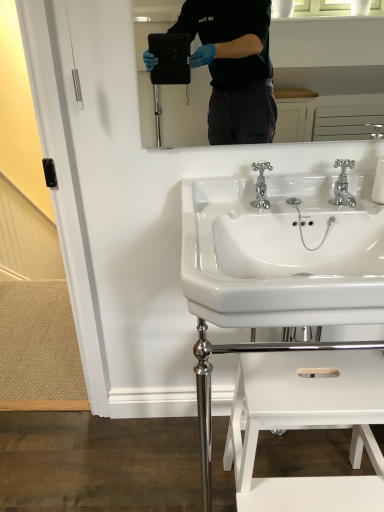
This screenshot has height=512, width=384. I want to click on white glossy sink at center, arranged as the 1th sink when viewed from the top, so [282, 253].

What do you see at coordinates (307, 425) in the screenshot? This screenshot has width=384, height=512. I see `white glossy step stool at lower center` at bounding box center [307, 425].

I want to click on white glossy sink at center, acting as the 2th sink starting from the bottom, so click(282, 253).

Does point (349, 160) come farther from viewer compared to point (299, 238)?

Yes, it is.

From a real-world perspective, count 2nd sinks downward from the chrome metallic faucet at upper right, which appears as the second tap when viewed from the left, and point to it. Please provide its 2D coordinates.

[(277, 268)]

Which object is positioned more to the right, chrome metallic faucet at upper right, positioned as the first tap in right-to-left order, or white glossy sink at center, the first sink when ordered from bottom to top?

From the viewer's perspective, chrome metallic faucet at upper right, positioned as the first tap in right-to-left order, appears more on the right side.

Does white glossy step stool at lower center have a greater width compared to white glossy sink at center, arranged as the 1th sink when viewed from the top?

In fact, white glossy step stool at lower center might be narrower than white glossy sink at center, arranged as the 1th sink when viewed from the top.

From the image's perspective, is white glossy step stool at lower center below white glossy sink at center, acting as the 2th sink starting from the bottom?

Yes, from the image's perspective, white glossy step stool at lower center is below white glossy sink at center, acting as the 2th sink starting from the bottom.

Between white glossy step stool at lower center and white glossy sink at center, acting as the 2th sink starting from the bottom, which one appears on the left side from the viewer's perspective?

white glossy sink at center, acting as the 2th sink starting from the bottom.

Considering the positions of point (345, 170) and point (254, 201), is point (345, 170) closer or farther from the camera than point (254, 201)?

Point (345, 170).

Does chrome metallic faucet at upper right, positioned as the first tap in right-to-left order, have a greater height compared to chrome metallic faucet at center, which is the 1th tap from left to right?

Indeed, chrome metallic faucet at upper right, positioned as the first tap in right-to-left order, has a greater height compared to chrome metallic faucet at center, which is the 1th tap from left to right.

Locate an element on the screen. The height and width of the screenshot is (512, 384). tap behind the chrome metallic faucet at center, which is the 1th tap from left to right is located at coordinates (343, 185).

Based on their positions, is chrome metallic faucet at upper right, positioned as the first tap in right-to-left order, located to the left or right of chrome metallic faucet at center, which is the 1th tap from left to right?

chrome metallic faucet at upper right, positioned as the first tap in right-to-left order, is positioned on chrome metallic faucet at center, which is the 1th tap from left to right,'s right side.

Is white glossy step stool at lower center not near white glossy sink at center, the first sink when ordered from bottom to top?

They are positioned close to each other.

Find the location of a particular element. This screenshot has width=384, height=512. sink behind the white glossy step stool at lower center is located at coordinates (277, 268).

From the picture: Does white glossy step stool at lower center appear on the left side of white glossy sink at center, the first sink when ordered from bottom to top?

Incorrect, white glossy step stool at lower center is not on the left side of white glossy sink at center, the first sink when ordered from bottom to top.

How different are the orientations of white glossy step stool at lower center and white glossy sink at center, the first sink when ordered from bottom to top, in degrees?

The angular difference between white glossy step stool at lower center and white glossy sink at center, the first sink when ordered from bottom to top, is 0.000236 degrees.

Is white glossy step stool at lower center bigger than chrome metallic faucet at center, which is the 1th tap from left to right?

Yes.

Considering the relative positions of white glossy step stool at lower center and chrome metallic faucet at center, which is the 1th tap from left to right, in the image provided, is white glossy step stool at lower center in front of chrome metallic faucet at center, which is the 1th tap from left to right,?

Yes, white glossy step stool at lower center is in front of chrome metallic faucet at center, which is the 1th tap from left to right.

Locate an element on the screen. Image resolution: width=384 pixels, height=512 pixels. tap that is the 1st object located behind the white glossy step stool at lower center is located at coordinates (261, 186).

Considering the sizes of objects white glossy step stool at lower center and chrome metallic faucet at upper right, which appears as the second tap when viewed from the left, in the image provided, who is shorter, white glossy step stool at lower center or chrome metallic faucet at upper right, which appears as the second tap when viewed from the left,?

chrome metallic faucet at upper right, which appears as the second tap when viewed from the left, is shorter.

From a real-world perspective, is white glossy step stool at lower center physically located above or below chrome metallic faucet at upper right, which appears as the second tap when viewed from the left?

Clearly, from a real-world perspective, white glossy step stool at lower center is below chrome metallic faucet at upper right, which appears as the second tap when viewed from the left.

Between white glossy step stool at lower center and chrome metallic faucet at upper right, which appears as the second tap when viewed from the left, which one has smaller size?

With smaller size is chrome metallic faucet at upper right, which appears as the second tap when viewed from the left.

What's the angular difference between chrome metallic faucet at center, which is the 1th tap from left to right, and chrome metallic faucet at upper right, positioned as the first tap in right-to-left order,'s facing directions?

They differ by 6.03e-05 degrees in their facing directions.

Who is more distant, chrome metallic faucet at center, which is the 1th tap from left to right, or chrome metallic faucet at upper right, positioned as the first tap in right-to-left order?

Positioned behind is chrome metallic faucet at upper right, positioned as the first tap in right-to-left order.

Which is correct: chrome metallic faucet at center, the second tap when ordered from right to left, is inside chrome metallic faucet at upper right, which appears as the second tap when viewed from the left, or outside of it?

chrome metallic faucet at center, the second tap when ordered from right to left, lies outside chrome metallic faucet at upper right, which appears as the second tap when viewed from the left.

Does chrome metallic faucet at center, which is the 1th tap from left to right, have a greater width compared to chrome metallic faucet at upper right, which appears as the second tap when viewed from the left?

Yes.

From the image's perspective, which sink is the 2nd one below the chrome metallic faucet at upper right, positioned as the first tap in right-to-left order? Please provide its 2D coordinates.

[(277, 268)]

Where is `step stool that appears on the right of white glossy sink at center, arranged as the 1th sink when viewed from the top`? This screenshot has height=512, width=384. step stool that appears on the right of white glossy sink at center, arranged as the 1th sink when viewed from the top is located at coordinates (307, 425).

Considering their positions, is white glossy step stool at lower center positioned further to chrome metallic faucet at upper right, positioned as the first tap in right-to-left order, than white glossy sink at center, arranged as the 1th sink when viewed from the top?

Based on the image, white glossy step stool at lower center appears to be further to chrome metallic faucet at upper right, positioned as the first tap in right-to-left order.

From the image, which object appears to be nearer to white glossy sink at center, acting as the 2th sink starting from the bottom, chrome metallic faucet at center, which is the 1th tap from left to right, or chrome metallic faucet at upper right, positioned as the first tap in right-to-left order?

Among the two, chrome metallic faucet at center, which is the 1th tap from left to right, is located nearer to white glossy sink at center, acting as the 2th sink starting from the bottom.

Estimate the real-world distances between objects in this image. Which object is closer to white glossy sink at center, the first sink when ordered from bottom to top, white glossy step stool at lower center or chrome metallic faucet at upper right, which appears as the second tap when viewed from the left?

white glossy step stool at lower center is closer to white glossy sink at center, the first sink when ordered from bottom to top.

Based on their spatial positions, is white glossy sink at center, acting as the 2th sink starting from the bottom, or white glossy step stool at lower center closer to chrome metallic faucet at upper right, which appears as the second tap when viewed from the left?

white glossy sink at center, acting as the 2th sink starting from the bottom, is positioned closer to the anchor chrome metallic faucet at upper right, which appears as the second tap when viewed from the left.

Estimate the real-world distances between objects in this image. Which object is closer to white glossy step stool at lower center, white glossy sink at center, arranged as the 2th sink when viewed from the top, or white glossy sink at center, arranged as the 1th sink when viewed from the top?

Among the two, white glossy sink at center, arranged as the 2th sink when viewed from the top, is located nearer to white glossy step stool at lower center.

Based on their spatial positions, is white glossy sink at center, acting as the 2th sink starting from the bottom, or chrome metallic faucet at center, which is the 1th tap from left to right, closer to white glossy step stool at lower center?

Among the two, white glossy sink at center, acting as the 2th sink starting from the bottom, is located nearer to white glossy step stool at lower center.

Estimate the real-world distances between objects in this image. Which object is closer to chrome metallic faucet at upper right, positioned as the first tap in right-to-left order, white glossy sink at center, arranged as the 1th sink when viewed from the top, or chrome metallic faucet at center, the second tap when ordered from right to left?

chrome metallic faucet at center, the second tap when ordered from right to left, lies closer to chrome metallic faucet at upper right, positioned as the first tap in right-to-left order, than the other object.

Estimate the real-world distances between objects in this image. Which object is further from white glossy sink at center, arranged as the 1th sink when viewed from the top, chrome metallic faucet at upper right, positioned as the first tap in right-to-left order, or chrome metallic faucet at center, the second tap when ordered from right to left?

chrome metallic faucet at upper right, positioned as the first tap in right-to-left order.

Find the location of `sink that lies between chrome metallic faucet at center, which is the 1th tap from left to right, and white glossy sink at center, arranged as the 2th sink when viewed from the top, from top to bottom`. sink that lies between chrome metallic faucet at center, which is the 1th tap from left to right, and white glossy sink at center, arranged as the 2th sink when viewed from the top, from top to bottom is located at coordinates (282, 253).

Image resolution: width=384 pixels, height=512 pixels. Find the location of `tap between white glossy sink at center, acting as the 2th sink starting from the bottom, and chrome metallic faucet at upper right, which appears as the second tap when viewed from the left, in the front-back direction`. tap between white glossy sink at center, acting as the 2th sink starting from the bottom, and chrome metallic faucet at upper right, which appears as the second tap when viewed from the left, in the front-back direction is located at coordinates (261, 186).

You are a GUI agent. You are given a task and a screenshot of the screen. Output one action in this format:
    pyautogui.click(x=<x>, y=<y>)
    Task: Click on the sink between white glossy sink at center, acting as the 2th sink starting from the bottom, and white glossy step stool at lower center vertically
    The width and height of the screenshot is (384, 512).
    Given the screenshot: What is the action you would take?
    pyautogui.click(x=277, y=268)

Where is `sink between chrome metallic faucet at upper right, which appears as the second tap when viewed from the left, and white glossy sink at center, the first sink when ordered from bottom to top, vertically`? sink between chrome metallic faucet at upper right, which appears as the second tap when viewed from the left, and white glossy sink at center, the first sink when ordered from bottom to top, vertically is located at coordinates [282, 253].